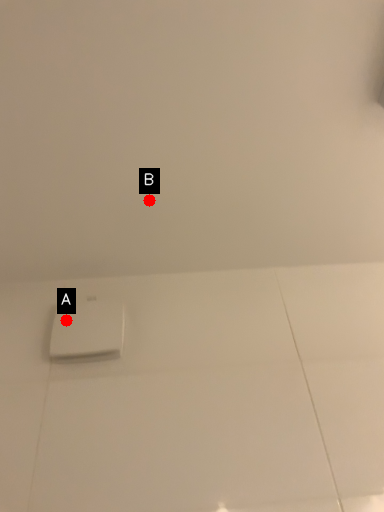
Question: Two points are circled on the image, labeled by A and B beside each circle. Which point is farther from the camera taking this photo?

Choices:
 (A) A is further
 (B) B is further

Answer: (A)